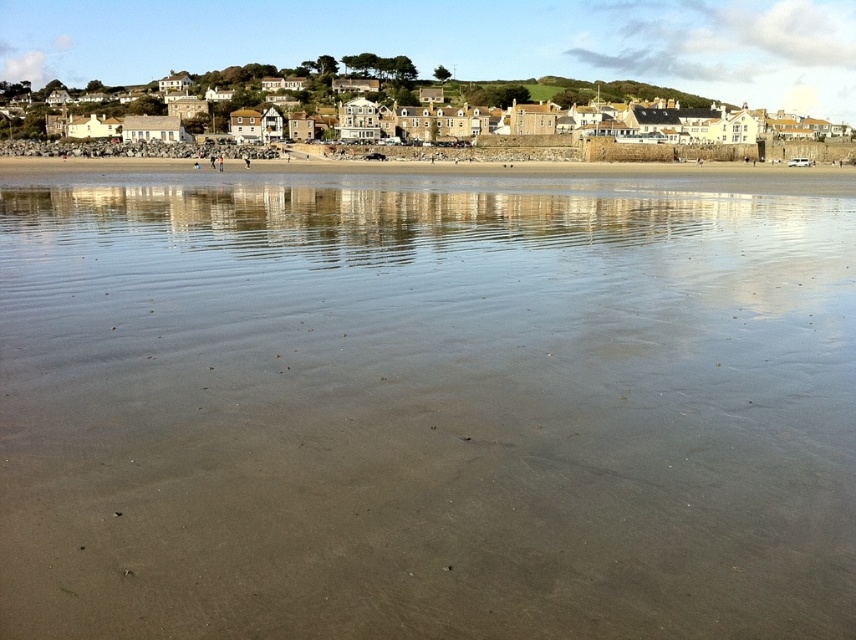
Which of these two, smooth sand at lower center or white stone houses at upper center, stands taller?

Standing taller between the two is white stone houses at upper center.

Does smooth sand at lower center have a greater width compared to white stone houses at upper center?

No, smooth sand at lower center is not wider than white stone houses at upper center.

The image size is (856, 640). Find the location of `smooth sand at lower center`. smooth sand at lower center is located at coordinates (424, 408).

Locate an element on the screen. smooth sand at lower center is located at coordinates (424, 408).